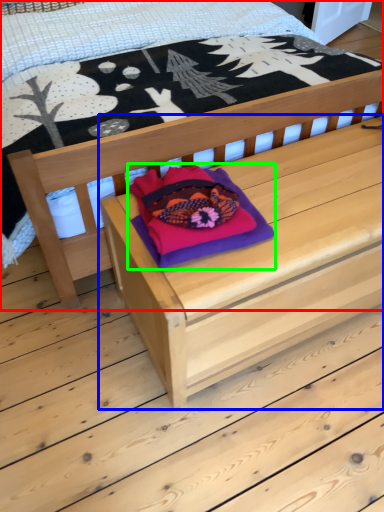
Question: Estimate the real-world distances between objects in this image. Which object is closer to bed (highlighted by a red box), table (highlighted by a blue box) or throw pillow (highlighted by a green box)?

Choices:
 (A) table
 (B) throw pillow

Answer: (A)